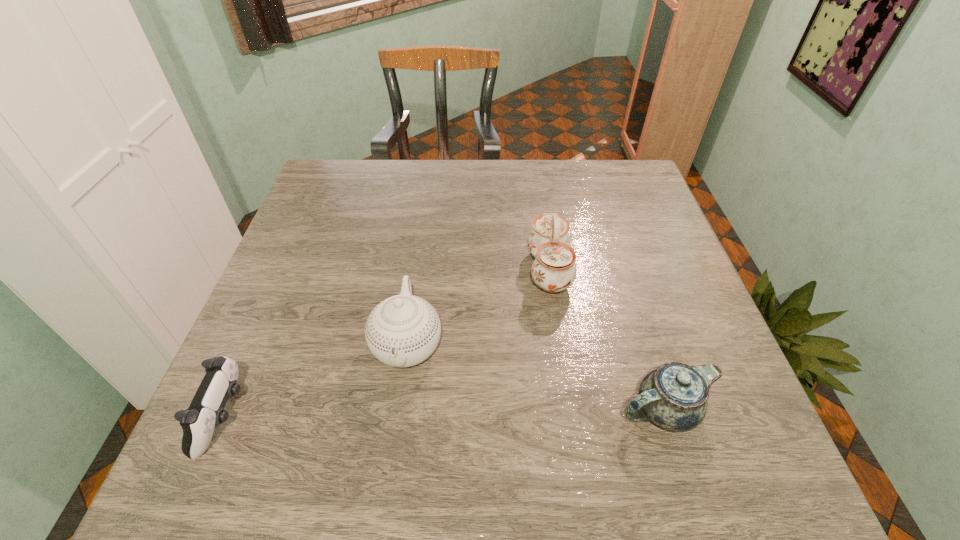
Find the location of a particular element. The width and height of the screenshot is (960, 540). vacant space that satisfies the following two spatial constraints: 1. on the spout of the leftmost chinaware; 2. on the front-facing side of the leftmost object is located at coordinates (397, 417).

Image resolution: width=960 pixels, height=540 pixels. Find the location of `free space that satisfies the following two spatial constraints: 1. by the handle of the third object from left to right; 2. on the spout of the leftmost chinaware`. free space that satisfies the following two spatial constraints: 1. by the handle of the third object from left to right; 2. on the spout of the leftmost chinaware is located at coordinates (561, 345).

This screenshot has width=960, height=540. Identify the location of blank area in the image that satisfies the following two spatial constraints: 1. by the handle of the second chinaware from right to left; 2. on the spout of the third object from right to left. (561, 345).

Identify the location of free space that satisfies the following two spatial constraints: 1. by the handle of the farthest object; 2. on the spout of the third object from right to left. 561,345.

Image resolution: width=960 pixels, height=540 pixels. I want to click on free space that satisfies the following two spatial constraints: 1. by the handle of the farthest object; 2. on the spout of the leftmost chinaware, so click(561, 345).